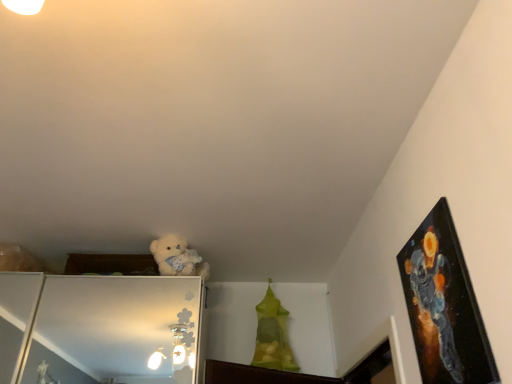
Question: Is point (417, 314) closer or farther from the camera than point (182, 253)?

Choices:
 (A) closer
 (B) farther

Answer: (A)

Question: Considering the positions of black glossy picture frame at upper right and fluffy white teddy bear at upper center in the image, is black glossy picture frame at upper right taller or shorter than fluffy white teddy bear at upper center?

Choices:
 (A) tall
 (B) short

Answer: (A)

Question: Is black glossy picture frame at upper right wider or thinner than fluffy white teddy bear at upper center?

Choices:
 (A) wide
 (B) thin

Answer: (B)

Question: Is fluffy white teddy bear at upper center spatially inside black glossy picture frame at upper right, or outside of it?

Choices:
 (A) inside
 (B) outside

Answer: (B)

Question: Considering their positions, is fluffy white teddy bear at upper center located in front of or behind black glossy picture frame at upper right?

Choices:
 (A) front
 (B) behind

Answer: (B)

Question: In terms of width, does fluffy white teddy bear at upper center look wider or thinner when compared to black glossy picture frame at upper right?

Choices:
 (A) thin
 (B) wide

Answer: (B)

Question: From a real-world perspective, is fluffy white teddy bear at upper center above or below black glossy picture frame at upper right?

Choices:
 (A) below
 (B) above

Answer: (B)